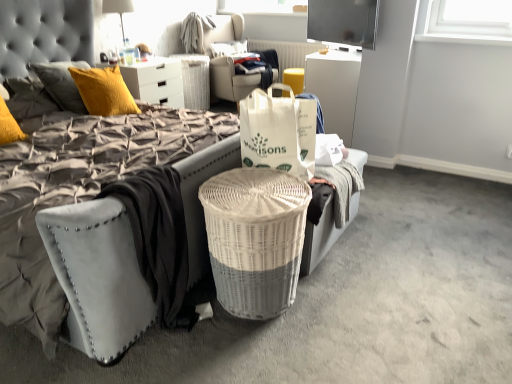
You are a GUI agent. You are given a task and a screenshot of the screen. Output one action in this format:
    pyautogui.click(x=<x>, y=<y>)
    Task: Click on the free spot to the right of clear glass bottle at upper center
    This screenshot has width=512, height=384.
    Given the screenshot: What is the action you would take?
    pyautogui.click(x=144, y=64)